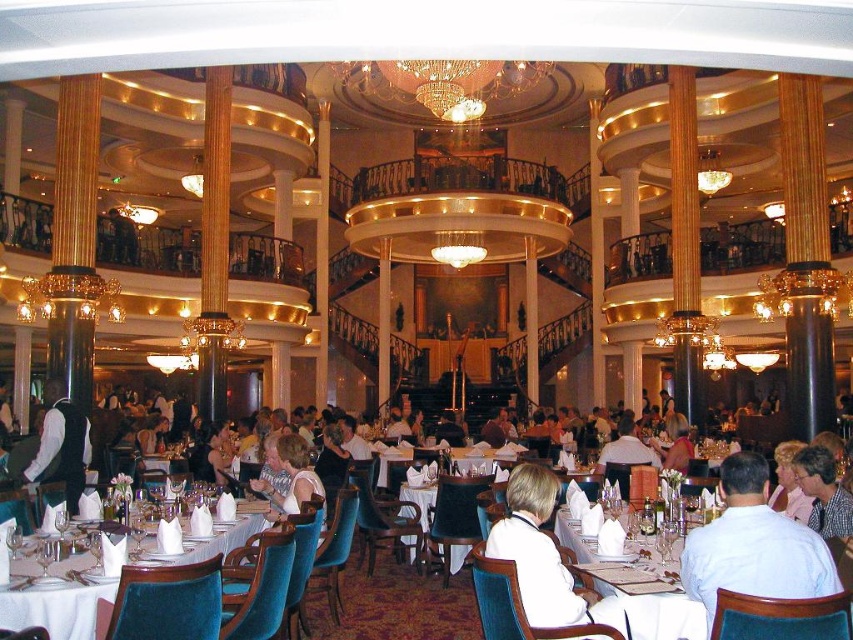
Question: Considering the relative positions of plaid shirt at center and white fabric dress at center in the image provided, where is plaid shirt at center located with respect to white fabric dress at center?

Choices:
 (A) below
 (B) above

Answer: (B)

Question: Where is white shirt at center located in relation to gold metallic chandelier at upper center in the image?

Choices:
 (A) right
 (B) left

Answer: (A)

Question: Which object is closer to the camera taking this photo?

Choices:
 (A) white paper napkin at center
 (B) white matte vest at left

Answer: (A)

Question: Considering the relative positions of white shirt at center and plaid shirt at center in the image provided, where is white shirt at center located with respect to plaid shirt at center?

Choices:
 (A) below
 (B) above

Answer: (B)

Question: Estimate the real-world distances between objects in this image. Which object is closer to the white cloth at center?

Choices:
 (A) plaid shirt at center
 (B) white fabric dress at center
 (C) white matte shirt at center
 (D) white shirt at center

Answer: (B)

Question: Which point is farther from the camera taking this photo?

Choices:
 (A) (810, 481)
 (B) (663, 572)
 (C) (312, 488)

Answer: (C)